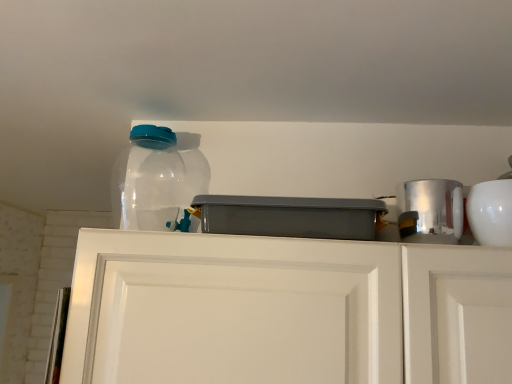
This screenshot has width=512, height=384. Describe the element at coordinates (161, 179) in the screenshot. I see `transparent plastic bottle at upper left` at that location.

Locate an element on the screen. This screenshot has height=384, width=512. white matte cabinet doors at center is located at coordinates (285, 311).

Would you say transparent plastic bottle at upper left is outside white matte cabinet doors at center?

Yes.

Consider the image. From the image's perspective, which is above, transparent plastic bottle at upper left or white matte cabinet doors at center?

transparent plastic bottle at upper left.

Is transparent plastic bottle at upper left smaller than white matte cabinet doors at center?

Correct, transparent plastic bottle at upper left occupies less space than white matte cabinet doors at center.

Is the position of transparent plastic bottle at upper left more distant than that of white matte cabinet doors at center?

Yes, it is behind white matte cabinet doors at center.

Which object is positioned more to the left, gray plastic container at center, marked as the third appliance in a right-to-left arrangement, or transparent plastic bottle at upper left?

transparent plastic bottle at upper left.

Considering the sizes of objects gray plastic container at center, marked as the third appliance in a right-to-left arrangement, and transparent plastic bottle at upper left in the image provided, who is taller, gray plastic container at center, marked as the third appliance in a right-to-left arrangement, or transparent plastic bottle at upper left?

transparent plastic bottle at upper left is taller.

Can you confirm if gray plastic container at center, placed as the 1th appliance when sorted from left to right, is thinner than transparent plastic bottle at upper left?

Incorrect, the width of gray plastic container at center, placed as the 1th appliance when sorted from left to right, is not less than that of transparent plastic bottle at upper left.

This screenshot has width=512, height=384. Find the location of `cabinetry below the transparent plastic bottle at upper left (from a real-world perspective)`. cabinetry below the transparent plastic bottle at upper left (from a real-world perspective) is located at coordinates (285, 311).

From the image's perspective, which is above, white matte cabinet doors at center or transparent plastic bottle at upper left?

transparent plastic bottle at upper left is shown above in the image.

Can you tell me how much white matte cabinet doors at center and transparent plastic bottle at upper left differ in facing direction?

white matte cabinet doors at center and transparent plastic bottle at upper left are facing 6.63 degrees away from each other.

Considering the relative sizes of white matte cabinet doors at center and transparent plastic bottle at upper left in the image provided, is white matte cabinet doors at center shorter than transparent plastic bottle at upper left?

No.

Considering the relative sizes of transparent plastic bottle at upper left and white glossy bowl at upper right, positioned as the 3th appliance in left-to-right order, in the image provided, is transparent plastic bottle at upper left wider than white glossy bowl at upper right, positioned as the 3th appliance in left-to-right order,?

No, transparent plastic bottle at upper left is not wider than white glossy bowl at upper right, positioned as the 3th appliance in left-to-right order.

What are the coordinates of `bottle behind the white glossy bowl at upper right, positioned as the 3th appliance in left-to-right order` in the screenshot? It's located at (161, 179).

Choose the correct answer: Is transparent plastic bottle at upper left inside white glossy bowl at upper right, positioned as the 3th appliance in left-to-right order, or outside it?

The correct answer is: outside.

Is transparent plastic bottle at upper left aimed at white glossy bowl at upper right, positioned as the 3th appliance in left-to-right order?

No, transparent plastic bottle at upper left is not facing towards white glossy bowl at upper right, positioned as the 3th appliance in left-to-right order.

Would you say gray plastic container at center, placed as the 1th appliance when sorted from left to right, contains white glossy bowl at upper right, positioned as the 3th appliance in left-to-right order?

No.

Are gray plastic container at center, placed as the 1th appliance when sorted from left to right, and white glossy bowl at upper right, marked as the first appliance in a right-to-left arrangement, beside each other?

No, gray plastic container at center, placed as the 1th appliance when sorted from left to right, is not next to white glossy bowl at upper right, marked as the first appliance in a right-to-left arrangement.

How far apart are gray plastic container at center, placed as the 1th appliance when sorted from left to right, and white glossy bowl at upper right, positioned as the 3th appliance in left-to-right order?

gray plastic container at center, placed as the 1th appliance when sorted from left to right, is 12.51 inches away from white glossy bowl at upper right, positioned as the 3th appliance in left-to-right order.

Does gray plastic container at center, placed as the 1th appliance when sorted from left to right, appear on the right side of white glossy bowl at upper right, positioned as the 3th appliance in left-to-right order?

No, gray plastic container at center, placed as the 1th appliance when sorted from left to right, is not to the right of white glossy bowl at upper right, positioned as the 3th appliance in left-to-right order.

Is gray plastic container at center, placed as the 1th appliance when sorted from left to right, inside or outside of silver metallic canister at right, the 2th appliance from the left?

gray plastic container at center, placed as the 1th appliance when sorted from left to right, cannot be found inside silver metallic canister at right, the 2th appliance from the left.

Is gray plastic container at center, marked as the third appliance in a right-to-left arrangement, positioned with its back to silver metallic canister at right, the 2th appliance from the left?

gray plastic container at center, marked as the third appliance in a right-to-left arrangement, is not turned away from silver metallic canister at right, the 2th appliance from the left.

Is point (354, 203) less distant than point (418, 238)?

Yes, it is in front of point (418, 238).

From the image's perspective, is transparent plastic bottle at upper left located above or below gray plastic container at center, placed as the 1th appliance when sorted from left to right?

transparent plastic bottle at upper left is situated higher than gray plastic container at center, placed as the 1th appliance when sorted from left to right, in the image.

From a real-world perspective, is transparent plastic bottle at upper left below gray plastic container at center, placed as the 1th appliance when sorted from left to right?

No, from a real-world perspective, transparent plastic bottle at upper left is not below gray plastic container at center, placed as the 1th appliance when sorted from left to right.

Which of these two, transparent plastic bottle at upper left or gray plastic container at center, marked as the third appliance in a right-to-left arrangement, is bigger?

gray plastic container at center, marked as the third appliance in a right-to-left arrangement, is bigger.

Find the location of a particular element. This screenshot has width=512, height=384. cabinetry below the transparent plastic bottle at upper left (from a real-world perspective) is located at coordinates (285, 311).

You are a GUI agent. You are given a task and a screenshot of the screen. Output one action in this format:
    pyautogui.click(x=<x>, y=<y>)
    Task: Click on the bottle lying above the gray plastic container at center, placed as the 1th appliance when sorted from left to right (from the image's perspective)
    The height and width of the screenshot is (384, 512).
    Given the screenshot: What is the action you would take?
    pyautogui.click(x=161, y=179)

Which object lies nearer to the anchor point white glossy bowl at upper right, positioned as the 3th appliance in left-to-right order, gray plastic container at center, marked as the third appliance in a right-to-left arrangement, or transparent plastic bottle at upper left?

gray plastic container at center, marked as the third appliance in a right-to-left arrangement.

Based on their spatial positions, is silver metallic canister at right, the 2th appliance from the left, or gray plastic container at center, placed as the 1th appliance when sorted from left to right, further from white glossy bowl at upper right, positioned as the 3th appliance in left-to-right order?

Based on the image, gray plastic container at center, placed as the 1th appliance when sorted from left to right, appears to be further to white glossy bowl at upper right, positioned as the 3th appliance in left-to-right order.

When comparing their distances from white matte cabinet doors at center, does transparent plastic bottle at upper left or white glossy bowl at upper right, positioned as the 3th appliance in left-to-right order, seem further?

Based on the image, transparent plastic bottle at upper left appears to be further to white matte cabinet doors at center.

Considering their positions, is silver metallic canister at right, the 2th appliance from the left, positioned further to white glossy bowl at upper right, marked as the first appliance in a right-to-left arrangement, than white matte cabinet doors at center?

white matte cabinet doors at center.

Considering their positions, is silver metallic canister at right, which is the 2th appliance from right to left, positioned further to gray plastic container at center, placed as the 1th appliance when sorted from left to right, than white matte cabinet doors at center?

silver metallic canister at right, which is the 2th appliance from right to left.

From the image, which object appears to be farther from white glossy bowl at upper right, positioned as the 3th appliance in left-to-right order, transparent plastic bottle at upper left or white matte cabinet doors at center?

transparent plastic bottle at upper left lies further to white glossy bowl at upper right, positioned as the 3th appliance in left-to-right order, than the other object.

Looking at the image, which one is located closer to silver metallic canister at right, the 2th appliance from the left, transparent plastic bottle at upper left or white glossy bowl at upper right, positioned as the 3th appliance in left-to-right order?

The object closer to silver metallic canister at right, the 2th appliance from the left, is white glossy bowl at upper right, positioned as the 3th appliance in left-to-right order.

Based on their spatial positions, is gray plastic container at center, placed as the 1th appliance when sorted from left to right, or white glossy bowl at upper right, marked as the first appliance in a right-to-left arrangement, further from transparent plastic bottle at upper left?

Based on the image, white glossy bowl at upper right, marked as the first appliance in a right-to-left arrangement, appears to be further to transparent plastic bottle at upper left.

Find the location of a particular element. The width and height of the screenshot is (512, 384). appliance located between transparent plastic bottle at upper left and white matte cabinet doors at center in the left-right direction is located at coordinates (289, 216).

Image resolution: width=512 pixels, height=384 pixels. I want to click on cabinetry between gray plastic container at center, marked as the third appliance in a right-to-left arrangement, and silver metallic canister at right, the 2th appliance from the left, from left to right, so click(285, 311).

Locate an element on the screen. appliance between transparent plastic bottle at upper left and silver metallic canister at right, which is the 2th appliance from right to left is located at coordinates (289, 216).

Locate an element on the screen. cabinetry situated between transparent plastic bottle at upper left and silver metallic canister at right, which is the 2th appliance from right to left, from left to right is located at coordinates (285, 311).